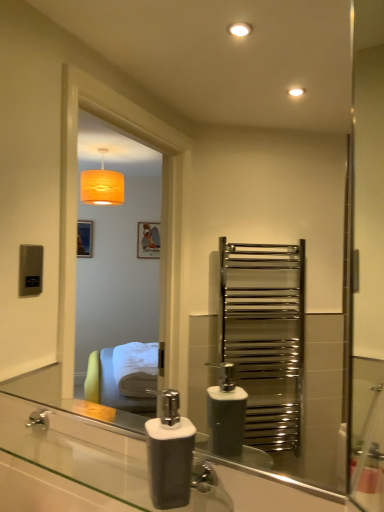
Question: Could you tell me if translucent glass soap dispenser at lower center is facing white matte soap dispenser at lower center?

Choices:
 (A) no
 (B) yes

Answer: (A)

Question: From a real-world perspective, is translucent glass soap dispenser at lower center located beneath white matte soap dispenser at lower center?

Choices:
 (A) no
 (B) yes

Answer: (B)

Question: Does translucent glass soap dispenser at lower center appear on the right side of white matte soap dispenser at lower center?

Choices:
 (A) yes
 (B) no

Answer: (B)

Question: From a real-world perspective, is translucent glass soap dispenser at lower center on top of white matte soap dispenser at lower center?

Choices:
 (A) no
 (B) yes

Answer: (A)

Question: Is white matte soap dispenser at lower center surrounded by translucent glass soap dispenser at lower center?

Choices:
 (A) no
 (B) yes

Answer: (A)

Question: Considering the relative sizes of translucent glass soap dispenser at lower center and white matte soap dispenser at lower center in the image provided, is translucent glass soap dispenser at lower center taller than white matte soap dispenser at lower center?

Choices:
 (A) yes
 (B) no

Answer: (B)

Question: Is white matte soap dispenser at lower center positioned beyond the bounds of translucent glass soap dispenser at lower center?

Choices:
 (A) yes
 (B) no

Answer: (A)

Question: Does white matte soap dispenser at lower center have a smaller size compared to translucent glass soap dispenser at lower center?

Choices:
 (A) no
 (B) yes

Answer: (B)

Question: From the image's perspective, would you say white matte soap dispenser at lower center is positioned over translucent glass soap dispenser at lower center?

Choices:
 (A) no
 (B) yes

Answer: (B)

Question: Is translucent glass soap dispenser at lower center at the back of white matte soap dispenser at lower center?

Choices:
 (A) no
 (B) yes

Answer: (A)

Question: Considering the relative sizes of white matte soap dispenser at lower center and translucent glass soap dispenser at lower center in the image provided, is white matte soap dispenser at lower center shorter than translucent glass soap dispenser at lower center?

Choices:
 (A) yes
 (B) no

Answer: (B)

Question: Is white matte soap dispenser at lower center at the left side of translucent glass soap dispenser at lower center?

Choices:
 (A) yes
 (B) no

Answer: (B)

Question: Considering the positions of white matte soap dispenser at lower center and translucent glass soap dispenser at lower center in the image, is white matte soap dispenser at lower center bigger or smaller than translucent glass soap dispenser at lower center?

Choices:
 (A) big
 (B) small

Answer: (B)